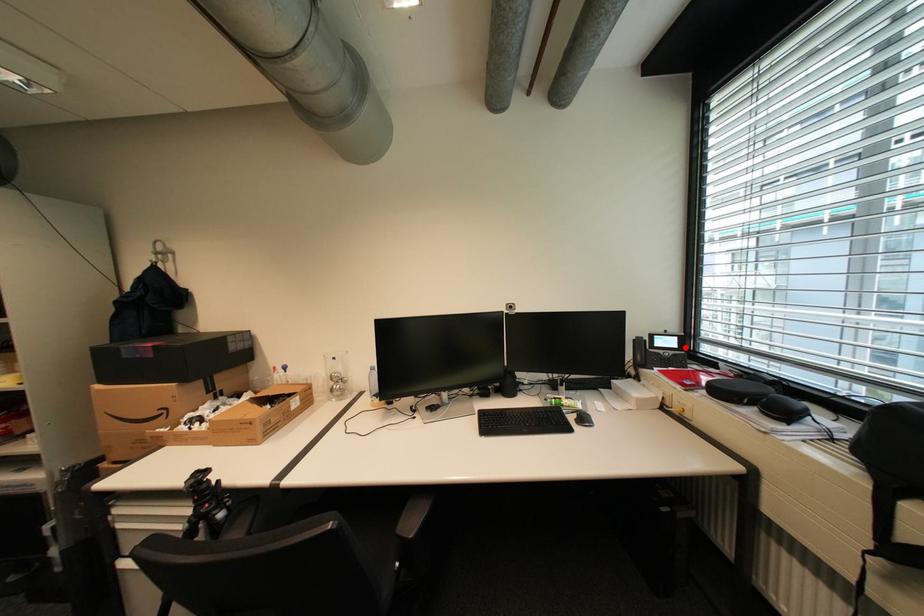
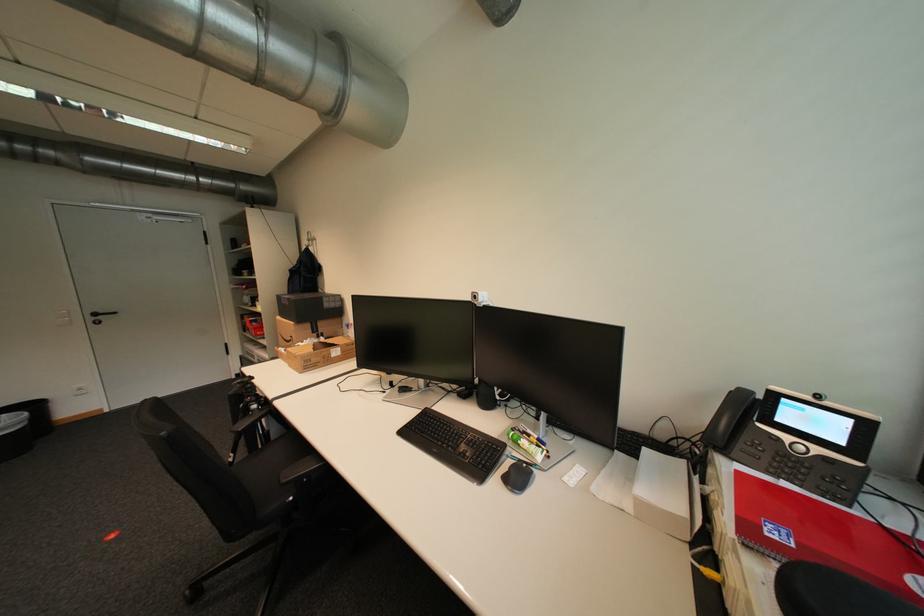
Where in the second image is the point corresponding to the highlighted location from the first image?

(850, 443)